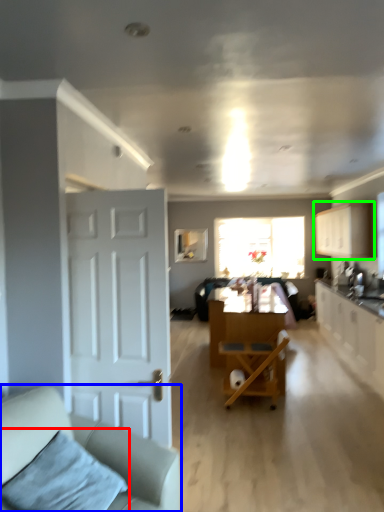
Question: Which is farther away from pillow (highlighted by a red box)? studio couch (highlighted by a blue box) or cabinetry (highlighted by a green box)?

Choices:
 (A) studio couch
 (B) cabinetry

Answer: (B)